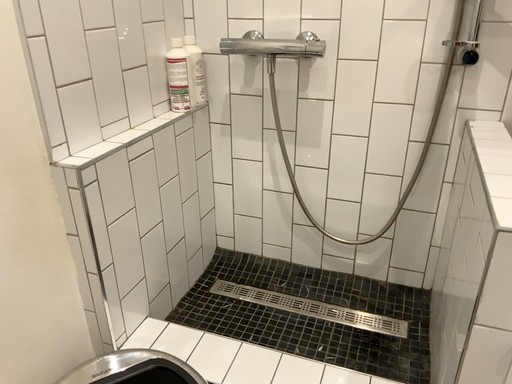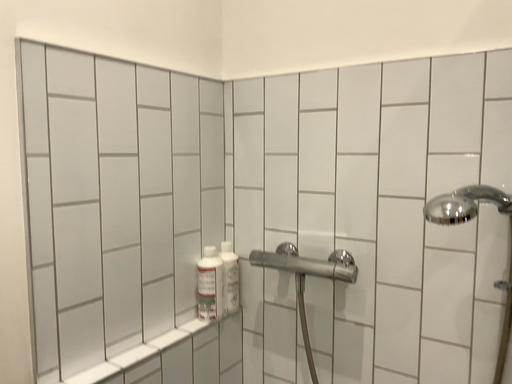
Question: How did the camera likely rotate when shooting the video?

Choices:
 (A) rotated left
 (B) rotated right

Answer: (A)